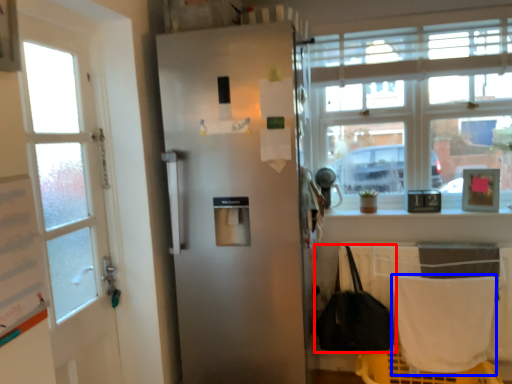
Question: Which object appears closest to the camera in this image, handbag (highlighted by a red box) or blanket (highlighted by a blue box)?

Choices:
 (A) handbag
 (B) blanket

Answer: (B)